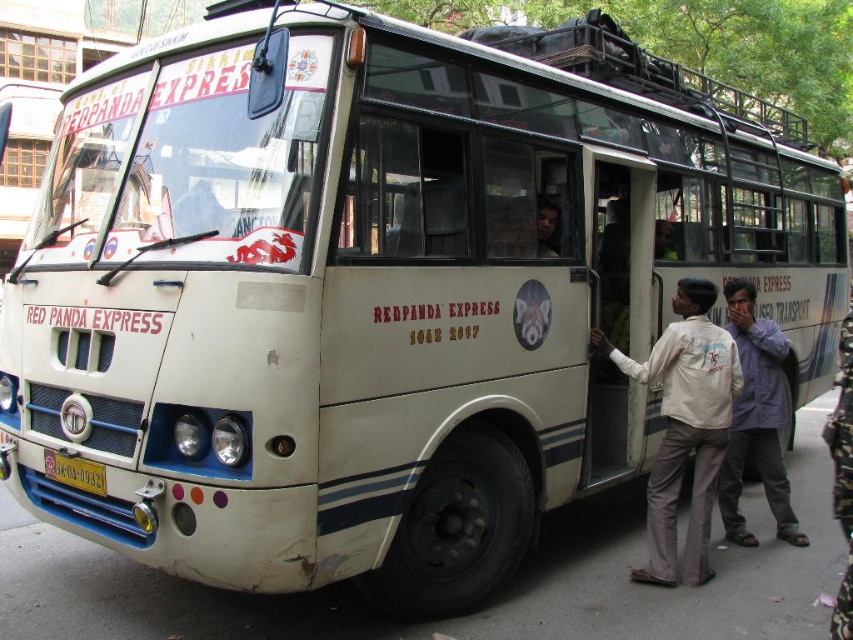
Can you confirm if white cotton shirt at right is positioned above light purple shirt at center?

No, white cotton shirt at right is not above light purple shirt at center.

Identify the location of white cotton shirt at right. The width and height of the screenshot is (853, 640). (683, 428).

Locate an element on the screen. This screenshot has width=853, height=640. white cotton shirt at right is located at coordinates (683, 428).

Between light purple shirt at center and yellow matte license plate at lower center, which one has more height?

light purple shirt at center

Does light purple shirt at center have a greater height compared to yellow matte license plate at lower center?

Yes, light purple shirt at center is taller than yellow matte license plate at lower center.

Based on the photo, who is more distant from viewer, (761, 465) or (57, 476)?

The point (761, 465) is behind.

Find the location of a particular element. Image resolution: width=853 pixels, height=640 pixels. light purple shirt at center is located at coordinates pyautogui.click(x=756, y=419).

Does point (631, 364) lie in front of point (90, 477)?

No, (631, 364) is behind (90, 477).

Between point (692, 387) and point (73, 467), which one is positioned in front?

Point (73, 467) is in front.

Measure the distance between white cotton shirt at right and camera.

They are 15.53 feet apart.

You are a GUI agent. You are given a task and a screenshot of the screen. Output one action in this format:
    pyautogui.click(x=<x>, y=<y>)
    Task: Click on the white cotton shirt at right
    Image resolution: width=853 pixels, height=640 pixels.
    Given the screenshot: What is the action you would take?
    pyautogui.click(x=683, y=428)